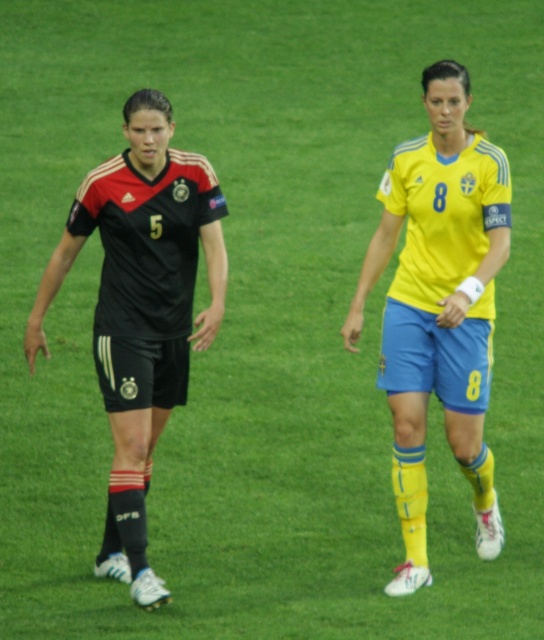
Consider the image. You are a soccer coach observing the field. You notice the yellow matte jersey at center and the matte black jersey at left. Which player has a narrower jersey?

The yellow matte jersey at center has a narrower jersey since its width is less than the matte black jersey at left.

You are a referee watching the soccer match and need to determine if the yellow matte jersey at center is in front of the matte black jersey at left. Based on the players positions, can you confirm this?

The yellow matte jersey at center is positioned over the matte black jersey at left, which means it is in front of it.